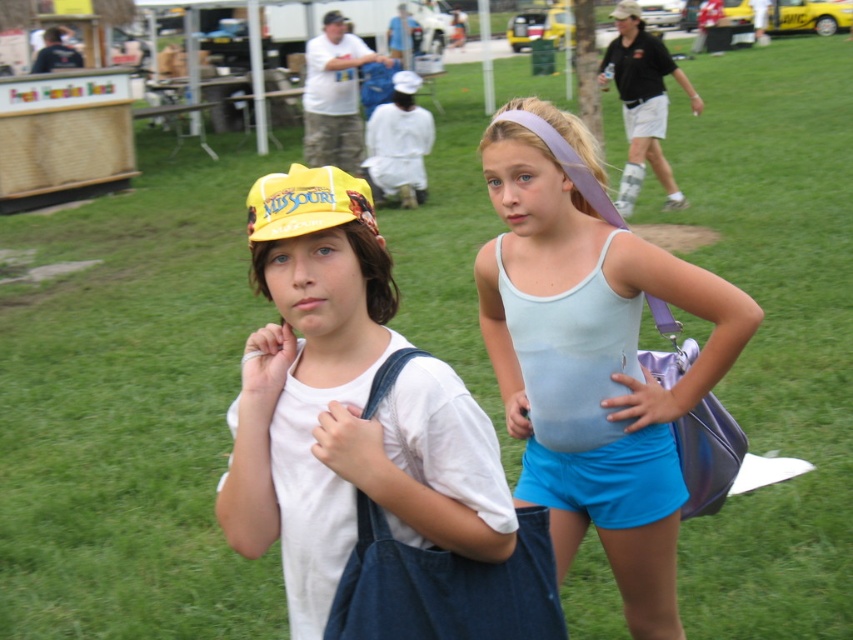
Question: Which object is closer to the camera taking this photo?

Choices:
 (A) yellow fabric cap at center
 (B) light blue fabric tank top at center

Answer: (B)

Question: Does white cotton shirt at center have a lesser width compared to yellow fabric cap at upper center?

Choices:
 (A) no
 (B) yes

Answer: (B)

Question: Which point is farther to the camera?

Choices:
 (A) white matte shirt at center
 (B) light blue fabric tank top at center

Answer: (A)

Question: Does white matte shirt at center appear over yellow fabric cap at upper center?

Choices:
 (A) yes
 (B) no

Answer: (B)

Question: Where is light blue fabric tank top at center located in relation to white fabric cap at upper center in the image?

Choices:
 (A) right
 (B) left

Answer: (B)

Question: Which object appears farthest from the camera in this image?

Choices:
 (A) white matte shirt at center
 (B) light blue fabric tank top at center
 (C) yellow fabric cap at upper center

Answer: (C)